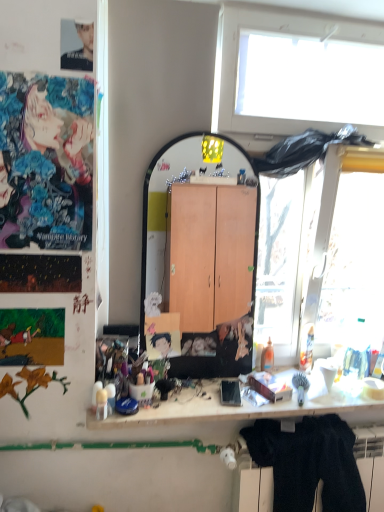
Question: Is white matte desk at center looking in the opposite direction of black fuzzy sweater at lower right?

Choices:
 (A) yes
 (B) no

Answer: (B)

Question: From a real-world perspective, is white matte desk at center under black fuzzy sweater at lower right?

Choices:
 (A) yes
 (B) no

Answer: (B)

Question: Does white matte desk at center come behind black fuzzy sweater at lower right?

Choices:
 (A) yes
 (B) no

Answer: (B)

Question: Does white matte desk at center appear on the right side of black fuzzy sweater at lower right?

Choices:
 (A) no
 (B) yes

Answer: (A)

Question: Is white matte desk at center thinner than black fuzzy sweater at lower right?

Choices:
 (A) no
 (B) yes

Answer: (A)

Question: In terms of width, does smooth black hair at center, which ranks as the 1th person in bottom-to-top order, look wider or thinner when compared to black fuzzy sweater at lower right?

Choices:
 (A) thin
 (B) wide

Answer: (A)

Question: Is smooth black hair at center, which is counted as the 1th person, starting from the back, spatially inside black fuzzy sweater at lower right, or outside of it?

Choices:
 (A) outside
 (B) inside

Answer: (A)

Question: Is point (165, 344) positioned closer to the camera than point (311, 416)?

Choices:
 (A) farther
 (B) closer

Answer: (A)

Question: Relative to black fuzzy sweater at lower right, is smooth black hair at center, which ranks as the 1th person in bottom-to-top order, in front or behind?

Choices:
 (A) front
 (B) behind

Answer: (B)

Question: Considering the positions of white matte desk at center and vivid anime poster at upper left, marked as the third person in a right-to-left arrangement, in the image, is white matte desk at center wider or thinner than vivid anime poster at upper left, marked as the third person in a right-to-left arrangement,?

Choices:
 (A) thin
 (B) wide

Answer: (B)

Question: From the image's perspective, relative to vivid anime poster at upper left, the second person when ordered from top to bottom, is white matte desk at center above or below?

Choices:
 (A) above
 (B) below

Answer: (B)

Question: Is white matte desk at center taller or shorter than vivid anime poster at upper left, the 1th person viewed from the front?

Choices:
 (A) short
 (B) tall

Answer: (A)

Question: Based on their positions, is white matte desk at center located to the left or right of vivid anime poster at upper left, marked as the third person in a right-to-left arrangement?

Choices:
 (A) left
 (B) right

Answer: (B)

Question: Choose the correct answer: Is matte black photo at upper left, which is counted as the first person, starting from the top, inside white matte desk at center or outside it?

Choices:
 (A) inside
 (B) outside

Answer: (B)

Question: From the image's perspective, is matte black photo at upper left, which is the 3th person in bottom-to-top order, above or below white matte desk at center?

Choices:
 (A) below
 (B) above

Answer: (B)